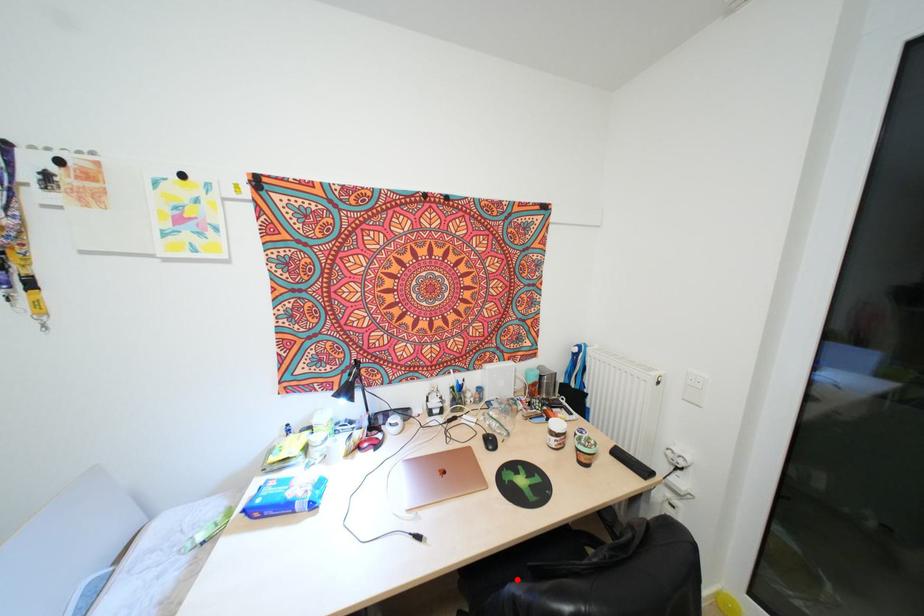
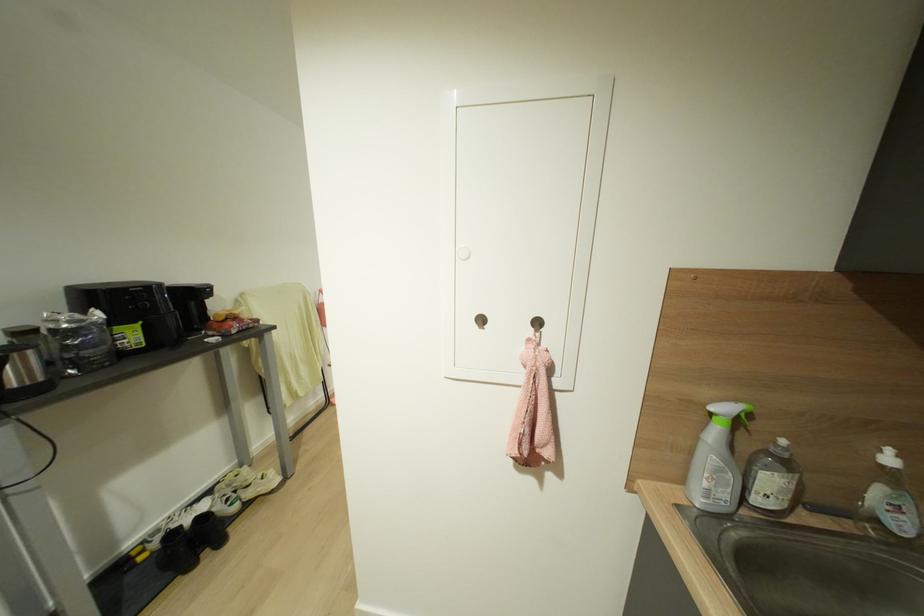
Question: I am providing you with two images of the same scene from different viewpoints. A red point is marked on the first image. Is the red point's position out of view in image 2?

Choices:
 (A) Yes
 (B) No

Answer: (A)